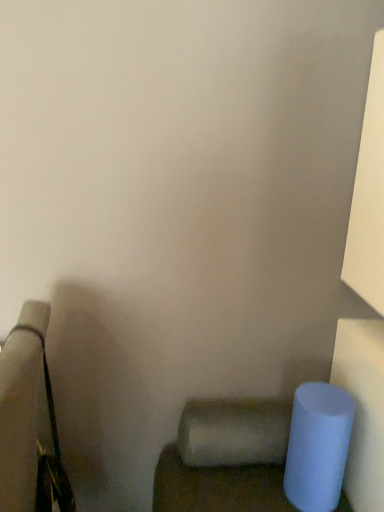
Where is `matte blue cylinder at lower right`? matte blue cylinder at lower right is located at coordinates (217, 487).

What do you see at coordinates (217, 487) in the screenshot?
I see `matte blue cylinder at lower right` at bounding box center [217, 487].

This screenshot has width=384, height=512. Describe the element at coordinates (234, 432) in the screenshot. I see `satin white toilet paper at lower center` at that location.

You are a GUI agent. You are given a task and a screenshot of the screen. Output one action in this format:
    pyautogui.click(x=<x>, y=<y>)
    Task: Click on the satin white toilet paper at lower center
    The height and width of the screenshot is (512, 384).
    Given the screenshot: What is the action you would take?
    pyautogui.click(x=234, y=432)

What is the approximate width of satin white toilet paper at lower center?

It is 6.68 inches.

In order to click on matte blue cylinder at lower right in this screenshot , I will do `click(217, 487)`.

Is satin white toilet paper at lower center at the left side of matte blue cylinder at lower right?

Indeed, satin white toilet paper at lower center is positioned on the left side of matte blue cylinder at lower right.

In the scene shown: Which object is further away from the camera taking this photo, satin white toilet paper at lower center or matte blue cylinder at lower right?

satin white toilet paper at lower center.

Which point is more forward, (252,407) or (170,497)?

Positioned in front is point (170,497).

From the image's perspective, who appears lower, satin white toilet paper at lower center or matte blue cylinder at lower right?

matte blue cylinder at lower right is shown below in the image.

From a real-world perspective, who is located higher, satin white toilet paper at lower center or matte blue cylinder at lower right?

From a 3D spatial view, satin white toilet paper at lower center is above.

Can you confirm if satin white toilet paper at lower center is thinner than matte blue cylinder at lower right?

Correct, the width of satin white toilet paper at lower center is less than that of matte blue cylinder at lower right.

Which of these two, satin white toilet paper at lower center or matte blue cylinder at lower right, stands taller?

matte blue cylinder at lower right is taller.

Considering the sizes of objects satin white toilet paper at lower center and matte blue cylinder at lower right in the image provided, who is bigger, satin white toilet paper at lower center or matte blue cylinder at lower right?

With larger size is matte blue cylinder at lower right.

Is satin white toilet paper at lower center located outside matte blue cylinder at lower right?

satin white toilet paper at lower center lies outside matte blue cylinder at lower right's area.

From the picture: Would you consider satin white toilet paper at lower center to be distant from matte blue cylinder at lower right?

satin white toilet paper at lower center is near matte blue cylinder at lower right, not far away.

Is satin white toilet paper at lower center aimed at matte blue cylinder at lower right?

No, satin white toilet paper at lower center is not facing towards matte blue cylinder at lower right.

How different are the orientations of satin white toilet paper at lower center and matte blue cylinder at lower right in degrees?

The facing directions of satin white toilet paper at lower center and matte blue cylinder at lower right are 0.000907 degrees apart.

Measure the distance between satin white toilet paper at lower center and matte blue cylinder at lower right.

A distance of 3.53 inches exists between satin white toilet paper at lower center and matte blue cylinder at lower right.

This screenshot has width=384, height=512. In order to click on toilet paper on the left of the matte blue cylinder at lower right in this screenshot , I will do `click(234, 432)`.

Considering the positions of objects matte blue cylinder at lower right and satin white toilet paper at lower center in the image provided, who is more to the left, matte blue cylinder at lower right or satin white toilet paper at lower center?

satin white toilet paper at lower center.

Which object is further away from the camera taking this photo, matte blue cylinder at lower right or satin white toilet paper at lower center?

satin white toilet paper at lower center.

Does point (230, 479) lie in front of point (245, 460)?

Yes.

From the image's perspective, between matte blue cylinder at lower right and satin white toilet paper at lower center, who is located below?

matte blue cylinder at lower right, from the image's perspective.

From a real-world perspective, is matte blue cylinder at lower right beneath satin white toilet paper at lower center?

→ Indeed, from a real-world perspective, matte blue cylinder at lower right is positioned beneath satin white toilet paper at lower center.

Looking at their sizes, would you say matte blue cylinder at lower right is wider or thinner than satin white toilet paper at lower center?

Clearly, matte blue cylinder at lower right has more width compared to satin white toilet paper at lower center.

In terms of height, does matte blue cylinder at lower right look taller or shorter compared to satin white toilet paper at lower center?

Considering their sizes, matte blue cylinder at lower right has more height than satin white toilet paper at lower center.

Is matte blue cylinder at lower right smaller than satin white toilet paper at lower center?

No.

Which is correct: matte blue cylinder at lower right is inside satin white toilet paper at lower center, or outside of it?

matte blue cylinder at lower right cannot be found inside satin white toilet paper at lower center.

Is the surface of matte blue cylinder at lower right in direct contact with satin white toilet paper at lower center?

Yes, matte blue cylinder at lower right is right next to satin white toilet paper at lower center and making contact.

Consider the image. Is matte blue cylinder at lower right facing towards satin white toilet paper at lower center?

No.

How different are the orientations of matte blue cylinder at lower right and satin white toilet paper at lower center in degrees?

There is a 0.000907-degree angle between the facing directions of matte blue cylinder at lower right and satin white toilet paper at lower center.

Identify the location of toilet paper above the matte blue cylinder at lower right (from the image's perspective). (234, 432).

The width and height of the screenshot is (384, 512). What are the coordinates of `furniture in front of the satin white toilet paper at lower center` in the screenshot? It's located at (217, 487).

What are the coordinates of `toilet paper on the left of matte blue cylinder at lower right` in the screenshot? It's located at (234, 432).